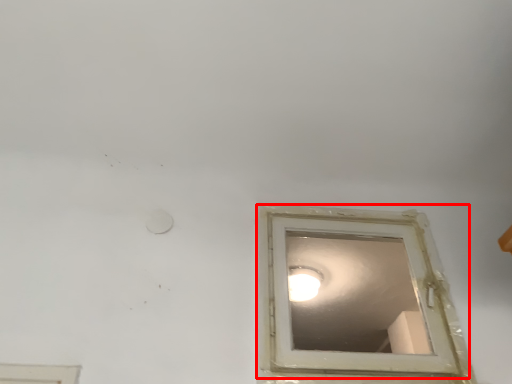
Question: From the image's perspective, considering the relative positions of window (annotated by the red box) and lighting in the image provided, where is window (annotated by the red box) located with respect to the staircase?

Choices:
 (A) below
 (B) above

Answer: (B)